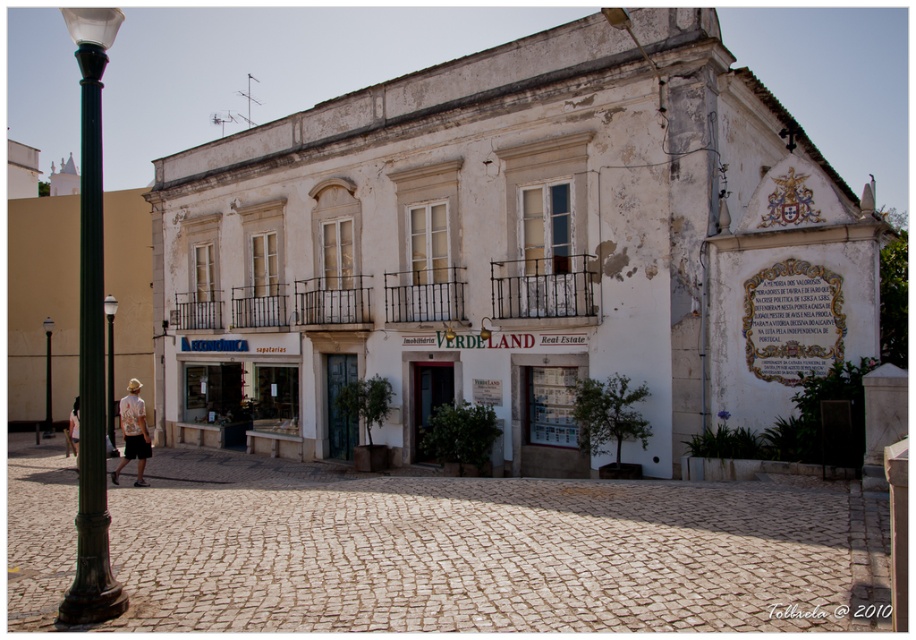
Question: Can you confirm if white cotton shirt at lower left is positioned to the left of black glass lamp post at left?

Choices:
 (A) yes
 (B) no

Answer: (A)

Question: Which point appears closest to the camera in this image?

Choices:
 (A) (48, 429)
 (B) (135, 454)
 (C) (108, 362)

Answer: (B)

Question: Can you confirm if green polished metal lamp post at left is positioned to the right of metallic pole at left?

Choices:
 (A) yes
 (B) no

Answer: (A)

Question: Which of these objects is positioned farthest from the green polished metal lamp post at left?

Choices:
 (A) black glass lamp post at left
 (B) white cotton shirt at lower left

Answer: (B)

Question: Which object appears closest to the camera in this image?

Choices:
 (A) black glass lamp post at left
 (B) green polished metal lamp post at left
 (C) white cotton shirt at lower left
 (D) metallic pole at left

Answer: (B)

Question: Can you confirm if green polished metal lamp post at left is positioned below metallic pole at left?

Choices:
 (A) yes
 (B) no

Answer: (B)